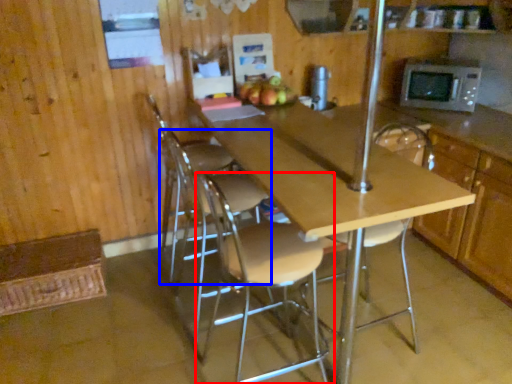
Question: Which point is closer to the camera, chair (highlighted by a red box) or chair (highlighted by a blue box)?

Choices:
 (A) chair
 (B) chair

Answer: (A)